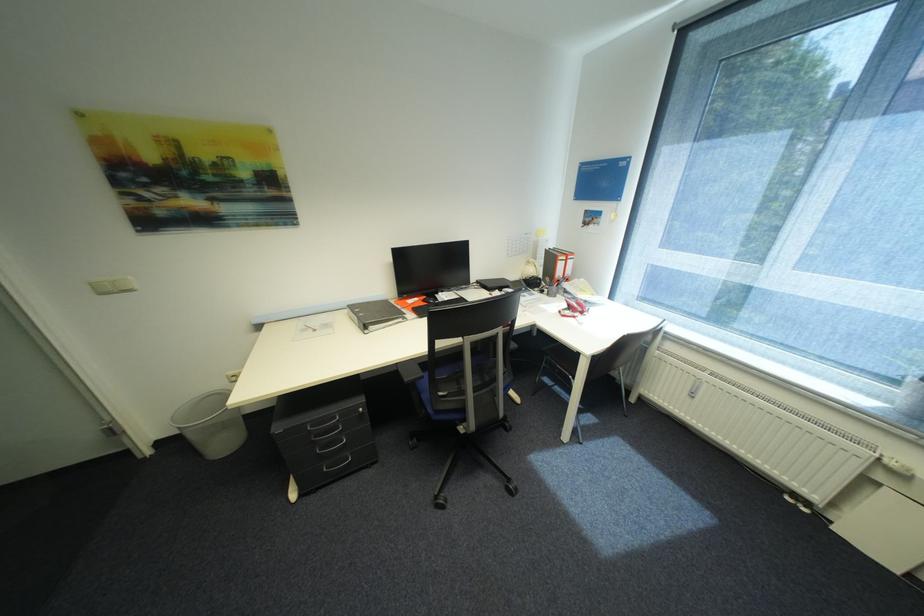
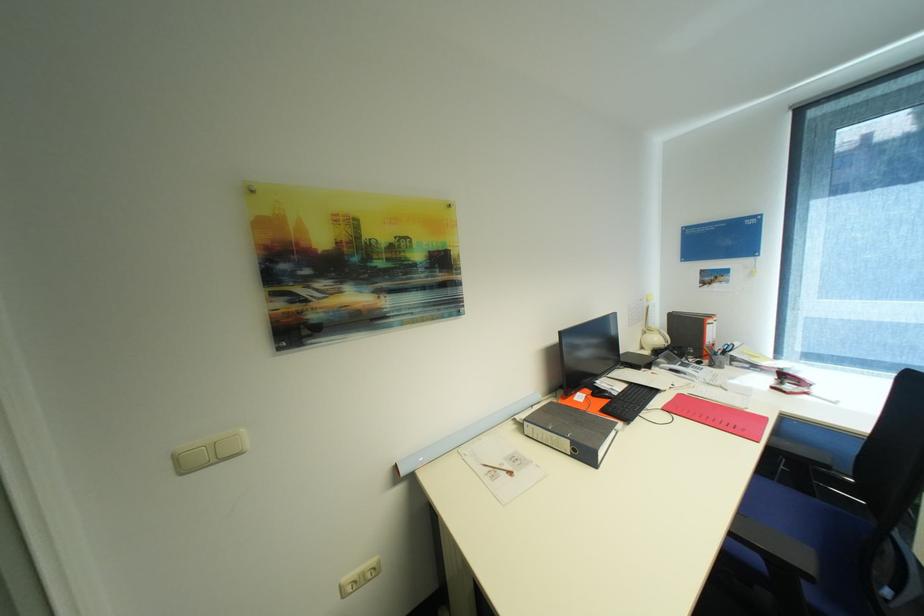
Where in the second image is the point corresponding to point 582,317 from the first image?

(813, 394)